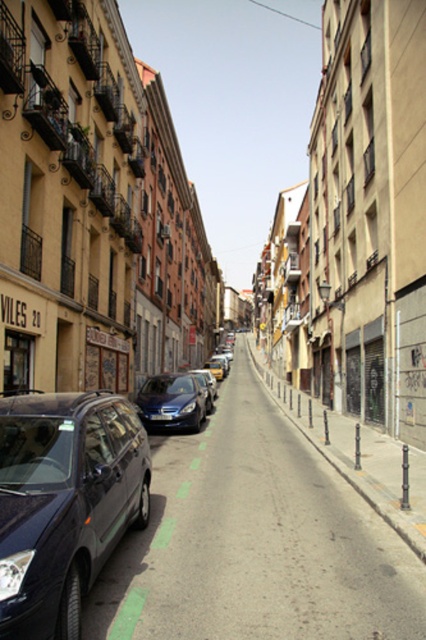
You are a delivery driver who needs to park your 5.5 meter long truck between the metallic blue minivan at left and the black plastic license plate at center. Is there enough space between them for your truck?

The distance between the metallic blue minivan at left and the black plastic license plate at center is 10.35 meters. Since your truck is 5.5 meters long, there is sufficient space as 10.35 meters is greater than 5.5 meters.

You are a delivery driver navigating through the narrow urban street. You need to pass by both the metallic gray car at left and the shiny blue sedan at center. Which vehicle should you pass first according to their positions?

You should pass the metallic gray car at left first because it is located below the shiny blue sedan at center, meaning it is closer to you on the street.

You are a delivery driver who needs to park your vehicle in this street. Your truck is 2 meters wide. The metallic gray car at left and the shiny blue sedan at center are parked here. Can your truck fit between them?

The metallic gray car at left is wider than the shiny blue sedan at center. Since the truck is 2 meters wide, you need to check the space between them. If the combined width of the metallic gray car at left and the shiny blue sedan at center leaves enough space for the truck, it might fit. However, without exact measurements of the gap, it is uncertain. Consider looking for another parking spot.